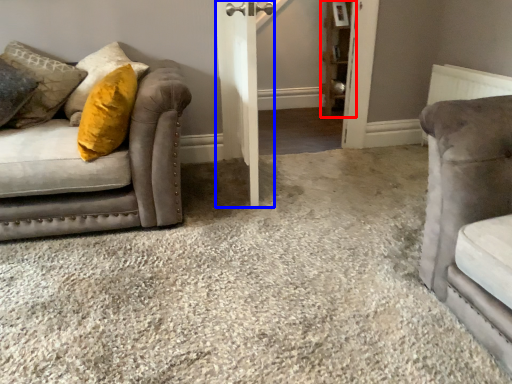
Question: Among these objects, which one is farthest to the camera, shelf (highlighted by a red box) or barn door (highlighted by a blue box)?

Choices:
 (A) shelf
 (B) barn door

Answer: (A)